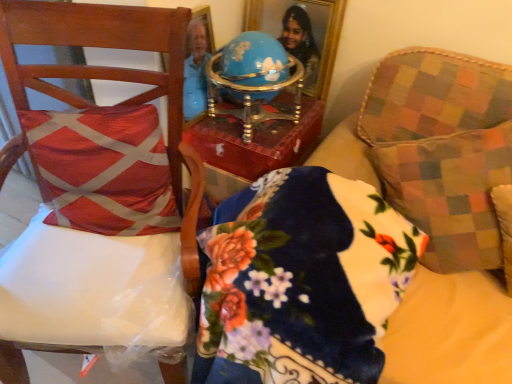
Question: Does red textured cushion at left, which is counted as the second throw pillow, starting from the right, have a lesser width compared to wooden chair at left?

Choices:
 (A) no
 (B) yes

Answer: (B)

Question: Is red textured cushion at left, which is counted as the second throw pillow, starting from the right, bigger than wooden chair at left?

Choices:
 (A) yes
 (B) no

Answer: (B)

Question: Is red textured cushion at left, the first throw pillow positioned from the left, wider than wooden chair at left?

Choices:
 (A) yes
 (B) no

Answer: (B)

Question: Does red textured cushion at left, which is counted as the second throw pillow, starting from the right, appear on the right side of wooden chair at left?

Choices:
 (A) no
 (B) yes

Answer: (A)

Question: From a real-world perspective, is red textured cushion at left, which is counted as the second throw pillow, starting from the right, on wooden chair at left?

Choices:
 (A) no
 (B) yes

Answer: (B)

Question: Do you think red textured cushion at left, the first throw pillow positioned from the left, is within gold-framed mirror at upper center, or outside of it?

Choices:
 (A) inside
 (B) outside

Answer: (B)

Question: From a real-world perspective, is red textured cushion at left, the first throw pillow positioned from the left, physically located above or below gold-framed mirror at upper center?

Choices:
 (A) above
 (B) below

Answer: (B)

Question: From their relative heights in the image, would you say red textured cushion at left, which is counted as the second throw pillow, starting from the right, is taller or shorter than gold-framed mirror at upper center?

Choices:
 (A) short
 (B) tall

Answer: (A)

Question: Does point (82, 221) appear closer or farther from the camera than point (287, 34)?

Choices:
 (A) closer
 (B) farther

Answer: (A)

Question: Considering the positions of point (9, 49) and point (106, 145), is point (9, 49) closer or farther from the camera than point (106, 145)?

Choices:
 (A) closer
 (B) farther

Answer: (A)

Question: Is wooden chair at left bigger or smaller than red textured cushion at left, the first throw pillow positioned from the left?

Choices:
 (A) big
 (B) small

Answer: (A)

Question: Would you say wooden chair at left is to the left or to the right of red textured cushion at left, which is counted as the second throw pillow, starting from the right, in the picture?

Choices:
 (A) left
 (B) right

Answer: (A)

Question: Would you say wooden chair at left is inside or outside red textured cushion at left, which is counted as the second throw pillow, starting from the right?

Choices:
 (A) inside
 (B) outside

Answer: (B)

Question: Is floral velvet pillow at center bigger or smaller than wooden chair at left?

Choices:
 (A) small
 (B) big

Answer: (A)

Question: In terms of height, does floral velvet pillow at center look taller or shorter compared to wooden chair at left?

Choices:
 (A) tall
 (B) short

Answer: (B)